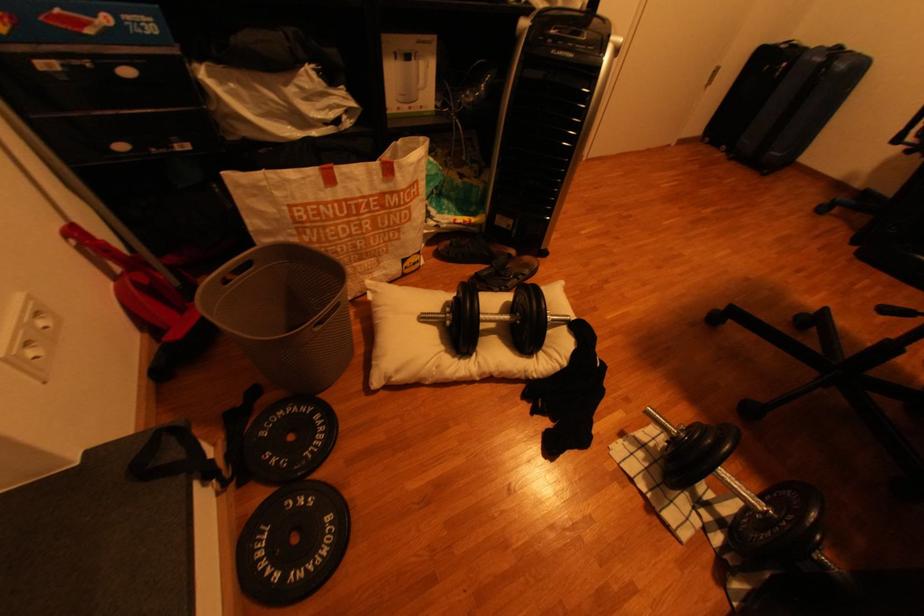
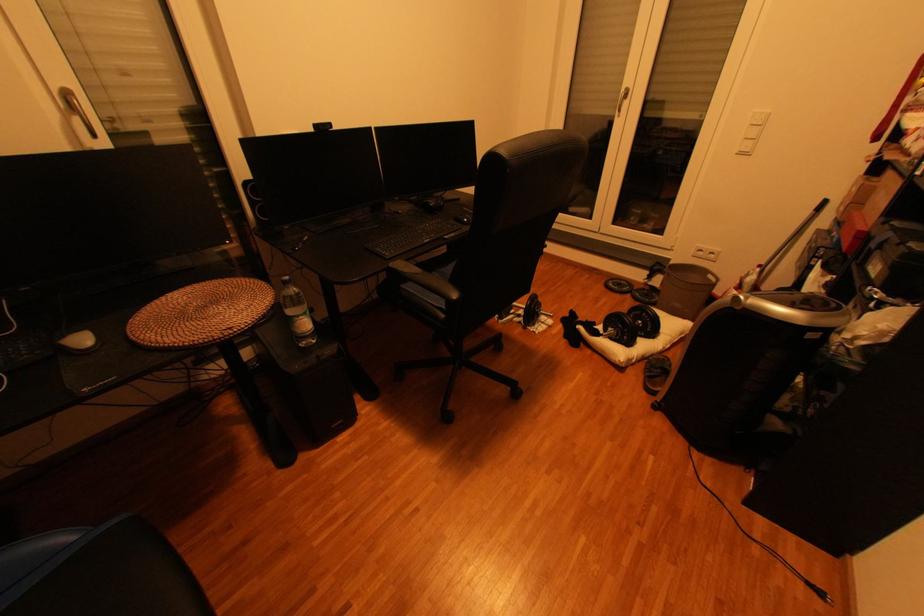
Locate, in the second image, the point that corresponds to [532,275] in the first image.

(658, 373)